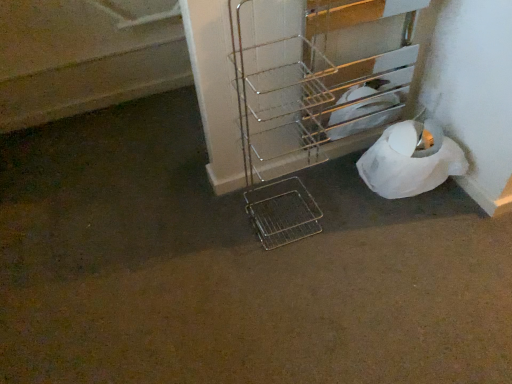
What do you see at coordinates (410, 160) in the screenshot? I see `white paper at lower right` at bounding box center [410, 160].

Image resolution: width=512 pixels, height=384 pixels. What do you see at coordinates (314, 98) in the screenshot?
I see `metallic wire trolley at lower right, acting as the first trolley starting from the right` at bounding box center [314, 98].

Where is `metallic wire trolley at center, marked as the second trolley in a right-to-left arrangement`? The width and height of the screenshot is (512, 384). metallic wire trolley at center, marked as the second trolley in a right-to-left arrangement is located at coordinates (269, 183).

Who is smaller, white paper at lower right or metallic wire trolley at center, marked as the second trolley in a right-to-left arrangement?

Smaller between the two is white paper at lower right.

From their relative heights in the image, would you say white paper at lower right is taller or shorter than metallic wire trolley at center, marked as the second trolley in a right-to-left arrangement?

Clearly, white paper at lower right is shorter compared to metallic wire trolley at center, marked as the second trolley in a right-to-left arrangement.

Between white paper at lower right and metallic wire trolley at center, the first trolley in the left-to-right sequence, which one appears on the right side from the viewer's perspective?

white paper at lower right is more to the right.

Is there a large distance between metallic wire trolley at center, marked as the second trolley in a right-to-left arrangement, and metallic wire trolley at lower right, placed as the 2th trolley when sorted from left to right?

No, there isn't a large distance between metallic wire trolley at center, marked as the second trolley in a right-to-left arrangement, and metallic wire trolley at lower right, placed as the 2th trolley when sorted from left to right.

From a real-world perspective, is metallic wire trolley at center, the first trolley in the left-to-right sequence, positioned over metallic wire trolley at lower right, acting as the first trolley starting from the right, based on gravity?

Yes.

Which is more to the left, metallic wire trolley at center, the first trolley in the left-to-right sequence, or metallic wire trolley at lower right, placed as the 2th trolley when sorted from left to right?

From the viewer's perspective, metallic wire trolley at center, the first trolley in the left-to-right sequence, appears more on the left side.

From the image's perspective, does metallic wire trolley at center, marked as the second trolley in a right-to-left arrangement, appear higher than metallic wire trolley at lower right, placed as the 2th trolley when sorted from left to right?

No, from the image's perspective, metallic wire trolley at center, marked as the second trolley in a right-to-left arrangement, is not on top of metallic wire trolley at lower right, placed as the 2th trolley when sorted from left to right.

In terms of height, does metallic wire trolley at center, marked as the second trolley in a right-to-left arrangement, look taller or shorter compared to white paper at lower right?

In the image, metallic wire trolley at center, marked as the second trolley in a right-to-left arrangement, appears to be taller than white paper at lower right.

Is metallic wire trolley at center, the first trolley in the left-to-right sequence, far from white paper at lower right?

metallic wire trolley at center, the first trolley in the left-to-right sequence, is near white paper at lower right, not far away.

Is metallic wire trolley at center, marked as the second trolley in a right-to-left arrangement, wider than white paper at lower right?

In fact, metallic wire trolley at center, marked as the second trolley in a right-to-left arrangement, might be narrower than white paper at lower right.

Between metallic wire trolley at center, the first trolley in the left-to-right sequence, and white paper at lower right, which one appears on the left side from the viewer's perspective?

Positioned to the left is metallic wire trolley at center, the first trolley in the left-to-right sequence.

Which is in front, metallic wire trolley at lower right, acting as the first trolley starting from the right, or metallic wire trolley at center, the first trolley in the left-to-right sequence?

metallic wire trolley at center, the first trolley in the left-to-right sequence, is closer to the camera.

Who is smaller, metallic wire trolley at lower right, placed as the 2th trolley when sorted from left to right, or metallic wire trolley at center, marked as the second trolley in a right-to-left arrangement?

metallic wire trolley at lower right, placed as the 2th trolley when sorted from left to right, is smaller.

Which is more to the left, metallic wire trolley at lower right, placed as the 2th trolley when sorted from left to right, or metallic wire trolley at center, marked as the second trolley in a right-to-left arrangement?

metallic wire trolley at center, marked as the second trolley in a right-to-left arrangement.

Is metallic wire trolley at lower right, acting as the first trolley starting from the right, shorter than metallic wire trolley at center, the first trolley in the left-to-right sequence?

Yes.

From a real-world perspective, is metallic wire trolley at lower right, placed as the 2th trolley when sorted from left to right, positioned over white paper at lower right based on gravity?

Correct, in the physical world, metallic wire trolley at lower right, placed as the 2th trolley when sorted from left to right, is higher than white paper at lower right.

Is metallic wire trolley at lower right, acting as the first trolley starting from the right, facing away from white paper at lower right?

metallic wire trolley at lower right, acting as the first trolley starting from the right, is not turned away from white paper at lower right.

Is point (318, 99) closer or farther from the camera than point (414, 128)?

Clearly, point (318, 99) is closer to the camera than point (414, 128).

From the image's perspective, which object appears higher, metallic wire trolley at lower right, placed as the 2th trolley when sorted from left to right, or white paper at lower right?

metallic wire trolley at lower right, placed as the 2th trolley when sorted from left to right, from the image's perspective.

Considering the sizes of white paper at lower right and metallic wire trolley at lower right, placed as the 2th trolley when sorted from left to right, in the image, is white paper at lower right taller or shorter than metallic wire trolley at lower right, placed as the 2th trolley when sorted from left to right,?

Considering their sizes, white paper at lower right has less height than metallic wire trolley at lower right, placed as the 2th trolley when sorted from left to right.

Can you confirm if white paper at lower right is wider than metallic wire trolley at lower right, placed as the 2th trolley when sorted from left to right?

Indeed, white paper at lower right has a greater width compared to metallic wire trolley at lower right, placed as the 2th trolley when sorted from left to right.

The image size is (512, 384). In the image, there is a metallic wire trolley at lower right, placed as the 2th trolley when sorted from left to right. In order to click on toilet paper below it (from a real-world perspective) in this screenshot , I will do `click(410, 160)`.

How much distance is there between white paper at lower right and metallic wire trolley at lower right, acting as the first trolley starting from the right?

11.96 inches.

There is a white paper at lower right. Identify the location of the 1st trolley above it (from the image's perspective). (269, 183).

In order to click on trolley in front of the metallic wire trolley at lower right, acting as the first trolley starting from the right in this screenshot , I will do `click(269, 183)`.

From the image, which object appears to be nearer to metallic wire trolley at lower right, acting as the first trolley starting from the right, white paper at lower right or metallic wire trolley at center, marked as the second trolley in a right-to-left arrangement?

metallic wire trolley at center, marked as the second trolley in a right-to-left arrangement, is positioned closer to the anchor metallic wire trolley at lower right, acting as the first trolley starting from the right.

From the image, which object appears to be nearer to metallic wire trolley at lower right, placed as the 2th trolley when sorted from left to right, metallic wire trolley at center, the first trolley in the left-to-right sequence, or white paper at lower right?

The object closer to metallic wire trolley at lower right, placed as the 2th trolley when sorted from left to right, is metallic wire trolley at center, the first trolley in the left-to-right sequence.

From the image, which object appears to be farther from white paper at lower right, metallic wire trolley at center, the first trolley in the left-to-right sequence, or metallic wire trolley at lower right, placed as the 2th trolley when sorted from left to right?

Among the two, metallic wire trolley at center, the first trolley in the left-to-right sequence, is located further to white paper at lower right.

When comparing their distances from metallic wire trolley at center, the first trolley in the left-to-right sequence, does white paper at lower right or metallic wire trolley at lower right, placed as the 2th trolley when sorted from left to right, seem closer?

metallic wire trolley at lower right, placed as the 2th trolley when sorted from left to right, lies closer to metallic wire trolley at center, the first trolley in the left-to-right sequence, than the other object.

From the image, which object appears to be farther from metallic wire trolley at center, the first trolley in the left-to-right sequence, metallic wire trolley at lower right, acting as the first trolley starting from the right, or white paper at lower right?

white paper at lower right.

Estimate the real-world distances between objects in this image. Which object is further from white paper at lower right, metallic wire trolley at lower right, acting as the first trolley starting from the right, or metallic wire trolley at center, the first trolley in the left-to-right sequence?

Among the two, metallic wire trolley at center, the first trolley in the left-to-right sequence, is located further to white paper at lower right.

The height and width of the screenshot is (384, 512). Identify the location of trolley between metallic wire trolley at center, marked as the second trolley in a right-to-left arrangement, and white paper at lower right. (314, 98).